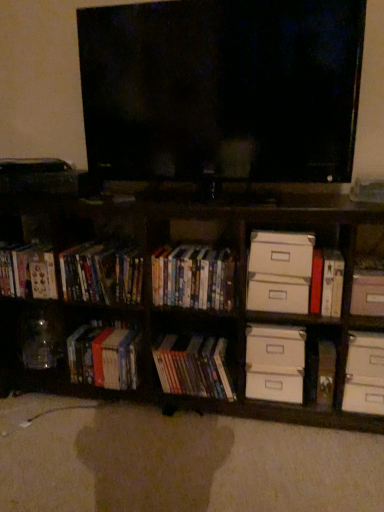
Question: In terms of height, does hardcover book at left, acting as the 1th book starting from the left, look taller or shorter compared to white cardboard drawer at upper right, which is the fourth drawer from bottom to top?

Choices:
 (A) tall
 (B) short

Answer: (A)

Question: Considering the positions of hardcover book at left, acting as the 1th book starting from the left, and white cardboard drawer at upper right, which is the fourth drawer from bottom to top, in the image, is hardcover book at left, acting as the 1th book starting from the left, bigger or smaller than white cardboard drawer at upper right, which is the fourth drawer from bottom to top,?

Choices:
 (A) big
 (B) small

Answer: (A)

Question: Which is farther from the white cardboard drawer at center, the 2th drawer from the bottom?

Choices:
 (A) hardcover books at center, arranged as the first book when viewed from the right
 (B) black glossy flat-screen tv at center
 (C) wooden bookcase at lower left
 (D) white cardboard drawer at lower right, arranged as the fourth drawer when viewed from the top
 (E) white cardboard drawer at center, the 2th drawer in the top-to-bottom sequence

Answer: (B)

Question: Which of these objects is positioned farthest from the black glossy flat-screen tv at center?

Choices:
 (A) white cardboard drawer at upper right, which is the first drawer from top to bottom
 (B) white cardboard drawer at center, which is the 3th drawer in bottom-to-top order
 (C) hardcover books at center, arranged as the first book when viewed from the right
 (D) matte plastic dvds at left, which ranks as the second cabinet in right-to-left order
 (E) hardcover book at right, which ranks as the first paperback book in top-to-bottom order

Answer: (E)